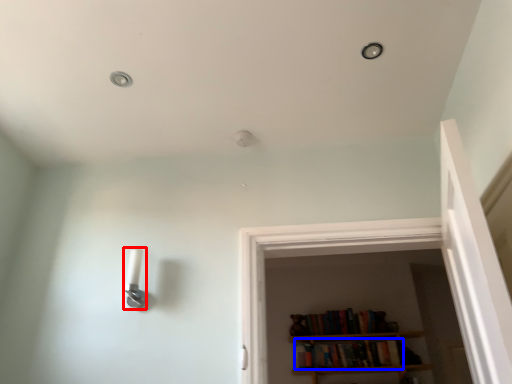
Question: Which of the following is the closest to the observer, light fixture (highlighted by a red box) or book (highlighted by a blue box)?

Choices:
 (A) light fixture
 (B) book

Answer: (A)